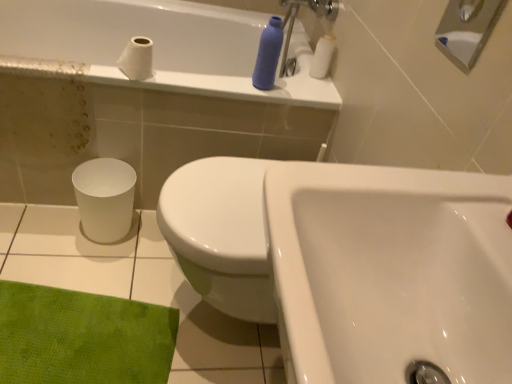
Where is `free space above white ceramic tile at lower left (from a real-world perspective)`? The width and height of the screenshot is (512, 384). free space above white ceramic tile at lower left (from a real-world perspective) is located at coordinates (103, 292).